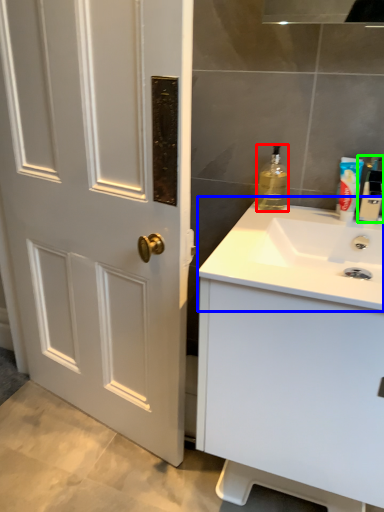
Question: Which is nearer to the bottle (highlighted by a red box)? sink (highlighted by a blue box) or bottle (highlighted by a green box).

Choices:
 (A) sink
 (B) bottle

Answer: (B)